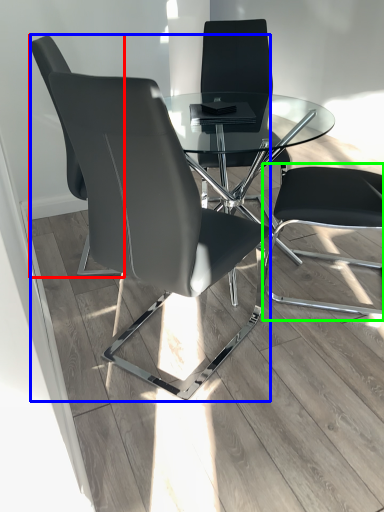
Question: Which object is the closest to the chair (highlighted by a red box)? Choose among these: chair (highlighted by a blue box) or computer chair (highlighted by a green box).

Choices:
 (A) chair
 (B) computer chair

Answer: (A)